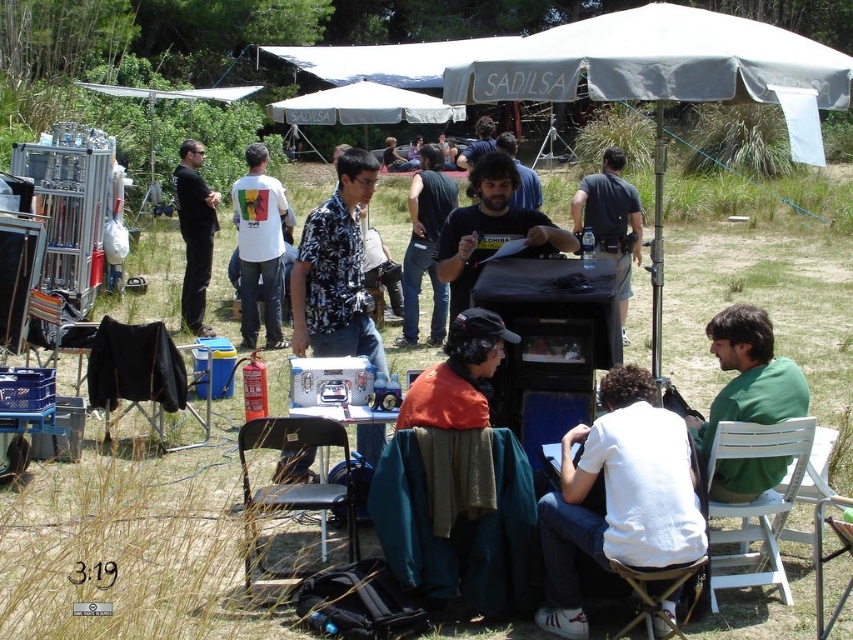
You are a photographer positioned at the camera. You notice two points in your viewfinder labeled as point 1 and point 2. Point 1 is at coordinates point (463, 244) and point 2 is at point (462, 365). Which point is closer to your camera lens?

Point (462, 365) is closer to the camera lens because the Objects Description states that point (463, 244) is further away than point (462, 365).